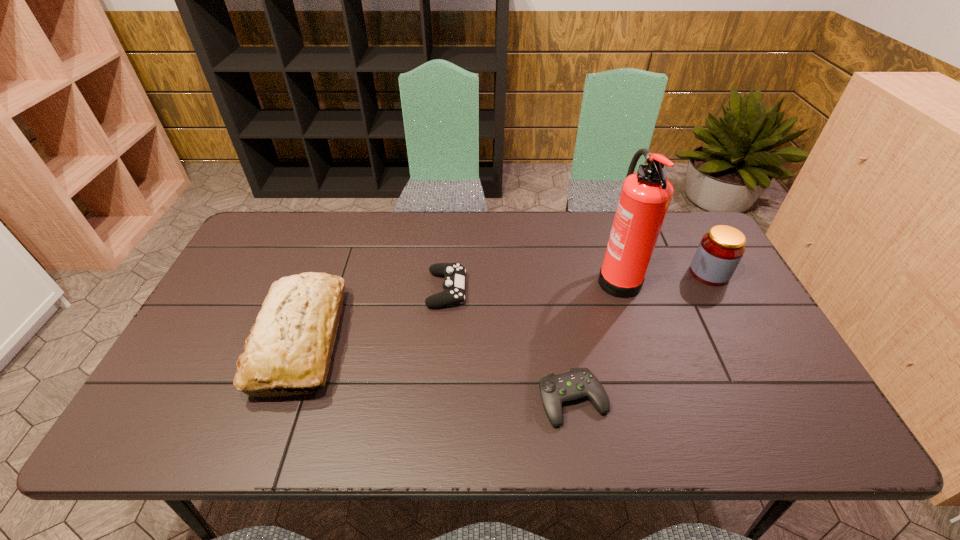
Find the location of a particular element. Image resolution: width=960 pixels, height=540 pixels. free region that satisfies the following two spatial constraints: 1. on the surface of the right control; 2. on the left side of the second object from left to right is located at coordinates (439, 400).

Locate an element on the screen. The height and width of the screenshot is (540, 960). free spot that satisfies the following two spatial constraints: 1. at the nozzle of the second object from right to left; 2. on the front side of the shortest object is located at coordinates (658, 400).

The height and width of the screenshot is (540, 960). I want to click on vacant area that satisfies the following two spatial constraints: 1. on the surface of the left control; 2. on the right side of the right control, so click(439, 400).